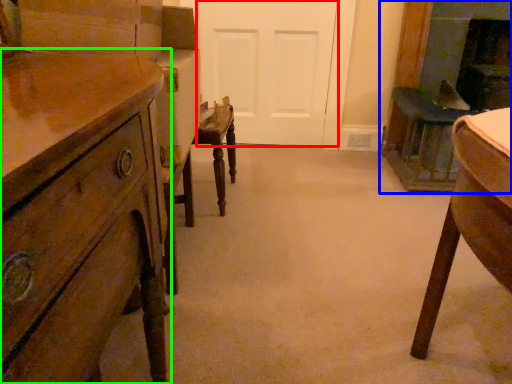
Question: Considering the real-world distances, which object is farthest from door (highlighted by a red box)? fireplace (highlighted by a blue box) or chest of drawers (highlighted by a green box)?

Choices:
 (A) fireplace
 (B) chest of drawers

Answer: (B)